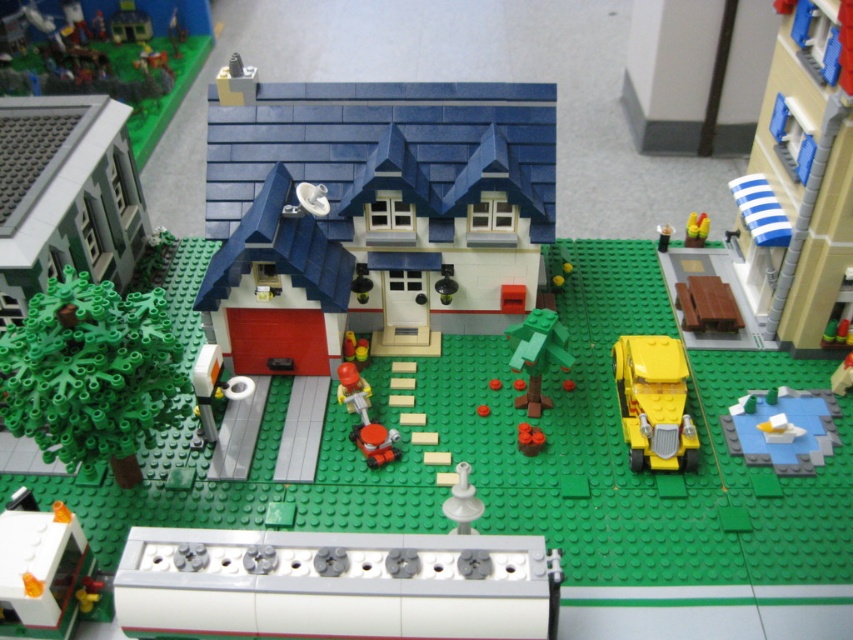
Does white plastic boat at lower right have a lesser height compared to orange matte ball at center?

Incorrect, white plastic boat at lower right's height does not fall short of orange matte ball at center's.

Which is in front, point (776, 461) or point (524, 435)?

Point (776, 461) is in front.

Image resolution: width=853 pixels, height=640 pixels. What are the coordinates of `white plastic boat at lower right` in the screenshot? It's located at (791, 422).

Does yellow plastic car at lower right have a smaller size compared to orange matte ball at center?

Actually, yellow plastic car at lower right might be larger than orange matte ball at center.

Find the location of a particular element. This screenshot has height=640, width=853. yellow plastic car at lower right is located at coordinates (654, 403).

Between point (656, 369) and point (531, 435), which one is positioned behind?

The point (531, 435) is behind.

What are the coordinates of `yellow plastic car at lower right` in the screenshot? It's located at (654, 403).

Does point (751, 276) lie in front of point (32, 429)?

No, (751, 276) is further to viewer.

The image size is (853, 640). Find the location of `yellow plastic car at right`. yellow plastic car at right is located at coordinates (799, 180).

Does point (799, 260) come in front of point (36, 339)?

No, it is behind (36, 339).

Locate an element on the screen. The width and height of the screenshot is (853, 640). yellow plastic car at right is located at coordinates (799, 180).